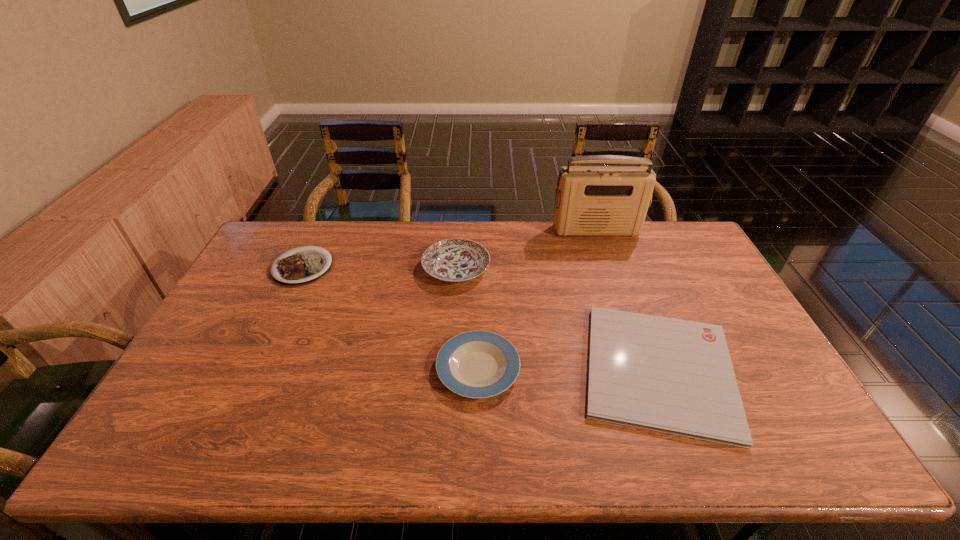
Locate an element on the screen. This screenshot has width=960, height=540. vacant space at the right edge of the desktop is located at coordinates (749, 334).

This screenshot has height=540, width=960. Identify the location of vacant space at the far left corner of the desktop. (296, 241).

This screenshot has width=960, height=540. In order to click on vacant space at the near left corner of the desktop in this screenshot , I will do `click(161, 456)`.

The height and width of the screenshot is (540, 960). I want to click on free spot at the far right corner of the desktop, so point(663,228).

Where is `vacant region between the nearest plate and the radio receiver`? Image resolution: width=960 pixels, height=540 pixels. vacant region between the nearest plate and the radio receiver is located at coordinates (538, 300).

You are a GUI agent. You are given a task and a screenshot of the screen. Output one action in this format:
    pyautogui.click(x=<x>, y=<y>)
    Task: Click on the free space between the second tallest object and the leftmost object
    The width and height of the screenshot is (960, 540).
    Given the screenshot: What is the action you would take?
    pyautogui.click(x=379, y=267)

You are a GUI agent. You are given a task and a screenshot of the screen. Output one action in this format:
    pyautogui.click(x=<x>, y=<y>)
    Task: Click on the vacant point located between the leftmost plate and the shortest object
    The image size is (960, 540).
    Given the screenshot: What is the action you would take?
    pyautogui.click(x=481, y=319)

Where is `empty location between the radio receiver and the nearest plate`? This screenshot has width=960, height=540. empty location between the radio receiver and the nearest plate is located at coordinates (538, 300).

The image size is (960, 540). I want to click on vacant space that is in between the shortest object and the tallest plate, so click(x=558, y=319).

Where is `free spot between the radio receiver and the nearest plate`? The height and width of the screenshot is (540, 960). free spot between the radio receiver and the nearest plate is located at coordinates (538, 300).